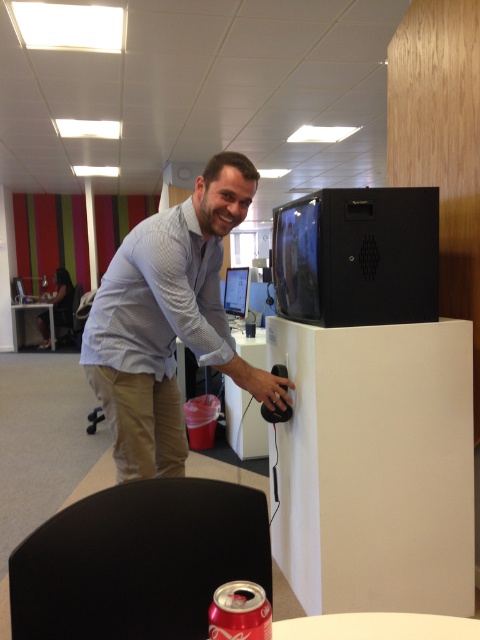
Measure the distance between light blue shirt at center and camera.

light blue shirt at center and camera are 5.76 feet apart.

The width and height of the screenshot is (480, 640). In order to click on light blue shirt at center in this screenshot , I will do `click(168, 321)`.

Locate an element on the screen. light blue shirt at center is located at coordinates (168, 321).

Locate an element on the screen. light blue shirt at center is located at coordinates (168, 321).

Does black plastic monitor at upper right lie in front of red matte soda can at lower center?

No, it is behind red matte soda can at lower center.

Which is above, black plastic monitor at upper right or red matte soda can at lower center?

black plastic monitor at upper right is above.

Measure the distance between black plastic monitor at upper right and camera.

They are 5.62 feet apart.

What are the coordinates of `black plastic monitor at upper right` in the screenshot? It's located at (358, 257).

Does light blue shirt at center appear on the right side of matte black monitor at center?

In fact, light blue shirt at center is to the left of matte black monitor at center.

Is point (192, 330) behind point (228, 282)?

No, (192, 330) is in front of (228, 282).

Between point (164, 220) and point (228, 310), which one is positioned in front?

Point (164, 220)

I want to click on light blue shirt at center, so click(x=168, y=321).